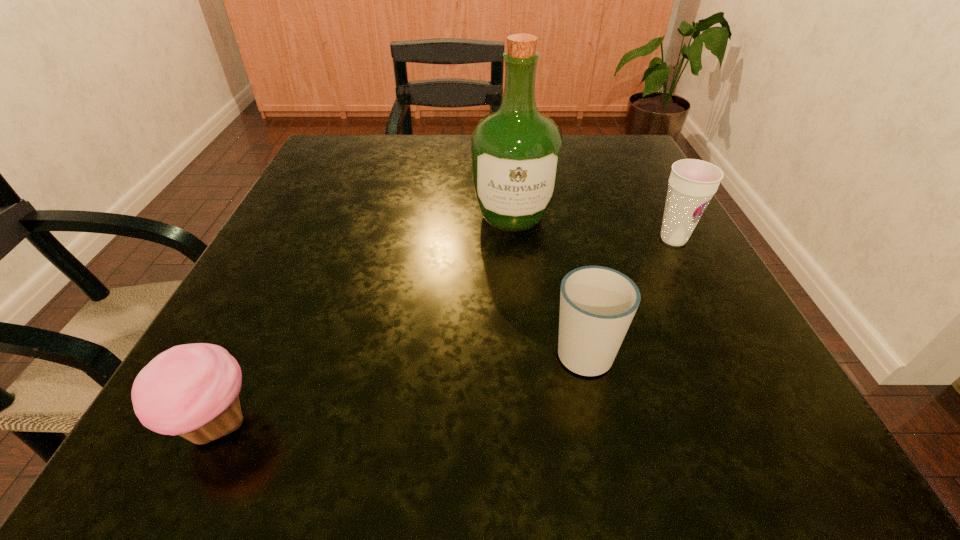
Find the location of a particular element. This screenshot has height=540, width=960. blank region between the right cup and the cupcake is located at coordinates (445, 331).

Locate an element on the screen. free space between the liquor and the second nearest object is located at coordinates (548, 284).

Identify the location of vacant space in between the tallest object and the third farthest object. This screenshot has height=540, width=960. (548, 284).

Point out which object is positioned as the second nearest to the cupcake. Please provide its 2D coordinates. Your answer should be formatted as a tuple, i.e. [(x, y)], where the tuple contains the x and y coordinates of a point satisfying the conditions above.

[(516, 151)]

Locate an element on the screen. Image resolution: width=960 pixels, height=540 pixels. object that is the second closest to the leftmost object is located at coordinates (516, 151).

You are a GUI agent. You are given a task and a screenshot of the screen. Output one action in this format:
    pyautogui.click(x=<x>, y=<y>)
    Task: Click on the vacant area that satisfies the following two spatial constraints: 1. with a handle on the side of the rightmost object; 2. on the left side of the nearer cup
    This screenshot has height=540, width=960.
    Given the screenshot: What is the action you would take?
    pyautogui.click(x=560, y=239)

Where is `vacant space that satisfies the following two spatial constraints: 1. on the front-facing side of the farther cup; 2. on the right side of the liquor`? The height and width of the screenshot is (540, 960). vacant space that satisfies the following two spatial constraints: 1. on the front-facing side of the farther cup; 2. on the right side of the liquor is located at coordinates (515, 239).